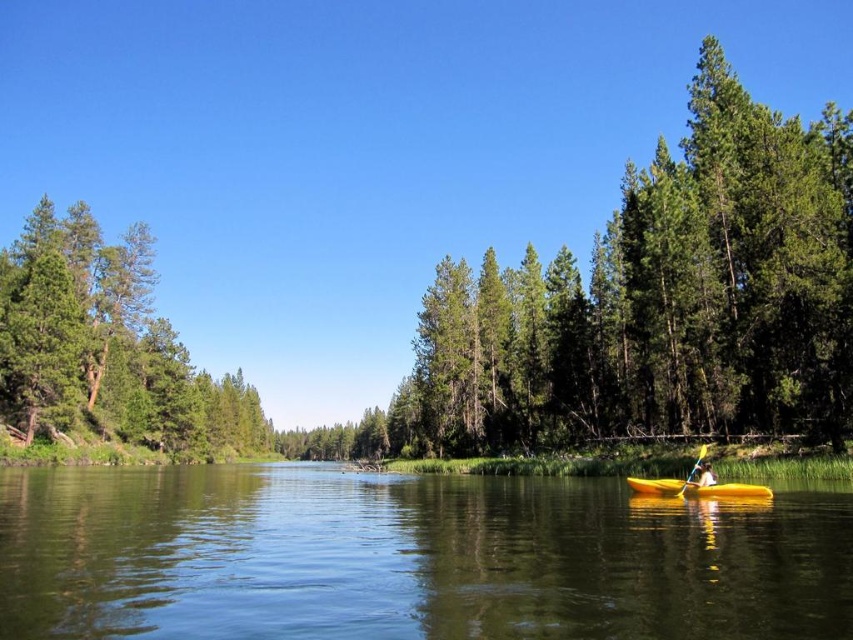
You are planning to take a photo of the green matte tree at left and the yellow matte kayak at lower center from a drone. The drone has a camera with a maximum focus range of 150 meters. Can the drone capture both objects in focus at the same time?

The green matte tree at left and yellow matte kayak at lower center are 129.58 meters apart from each other. Since the drone camera can focus up to 150 meters, both objects are within the maximum focus range and can be captured in focus simultaneously.

You are standing at the edge of the river in the serene natural scene. You see two points marked on the river surface. Which point is closer to you, point (462, 404) or point (695, 484)?

Point (462, 404) is further to the viewer than point (695, 484), so point (695, 484) is closer to you.

You are standing at the point with coordinates point [408,557] in the serene natural scene. What is the immediate surface you are standing on?

The point [408,557] corresponds to smooth water at center, so you are standing on smooth water at center.